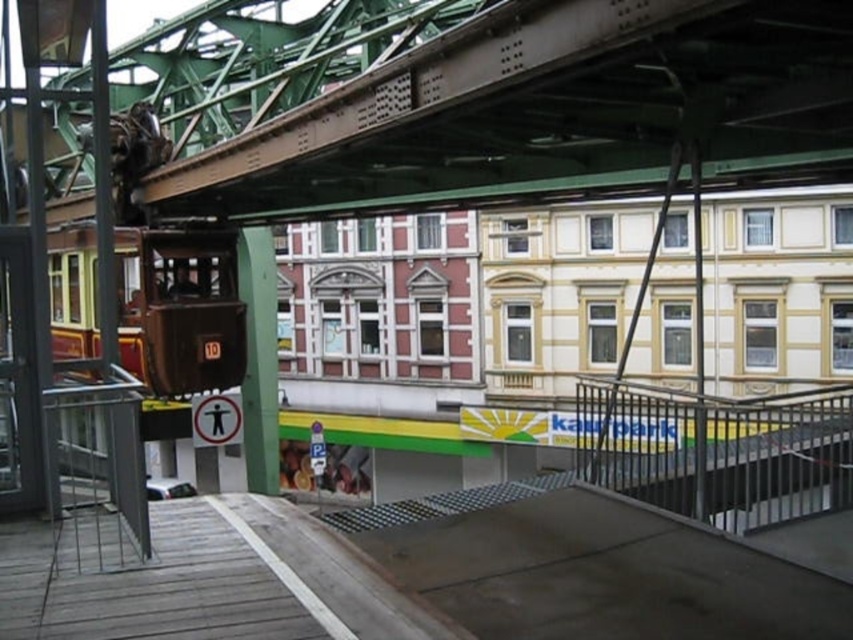
Which is more to the left, green metallic bridge at upper center or black metal railing at lower right?

green metallic bridge at upper center

Between point (416, 115) and point (744, 492), which one is positioned in front?

Point (416, 115)

Between point (805, 77) and point (666, 506), which one is positioned in front?

Point (805, 77) is more forward.

You are a GUI agent. You are given a task and a screenshot of the screen. Output one action in this format:
    pyautogui.click(x=<x>, y=<y>)
    Task: Click on the green metallic bridge at upper center
    
    Given the screenshot: What is the action you would take?
    pyautogui.click(x=548, y=112)